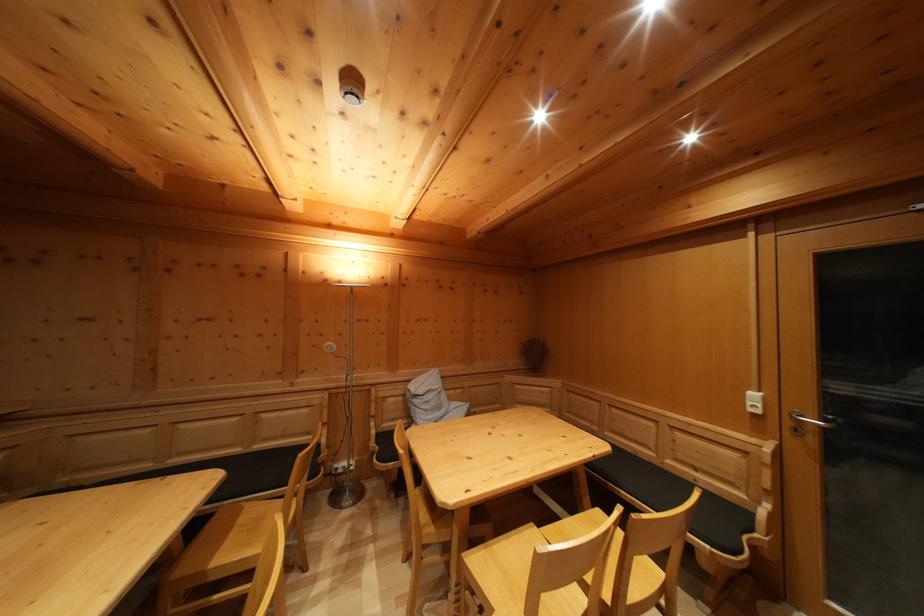
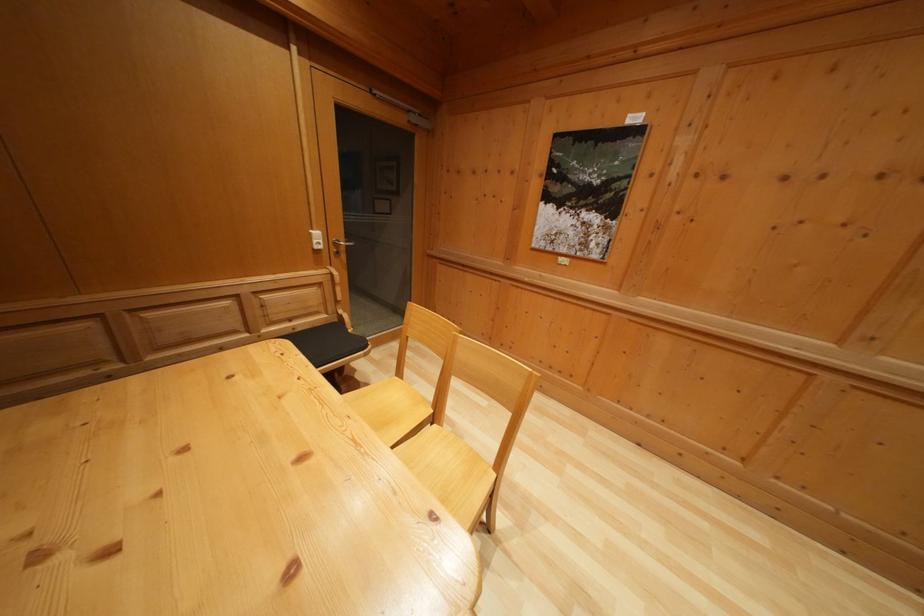
In the second image, find the point that corresponds to the point at 707,492 in the first image.

(305, 336)